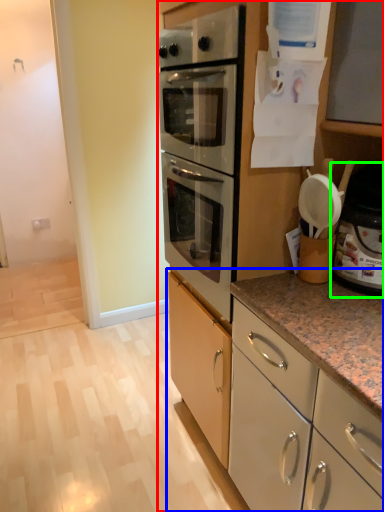
Question: Estimate the real-world distances between objects in this image. Which object is closer to cabinetry (highlighted by a red box), cabinetry (highlighted by a blue box) or appliance (highlighted by a green box)?

Choices:
 (A) cabinetry
 (B) appliance

Answer: (A)